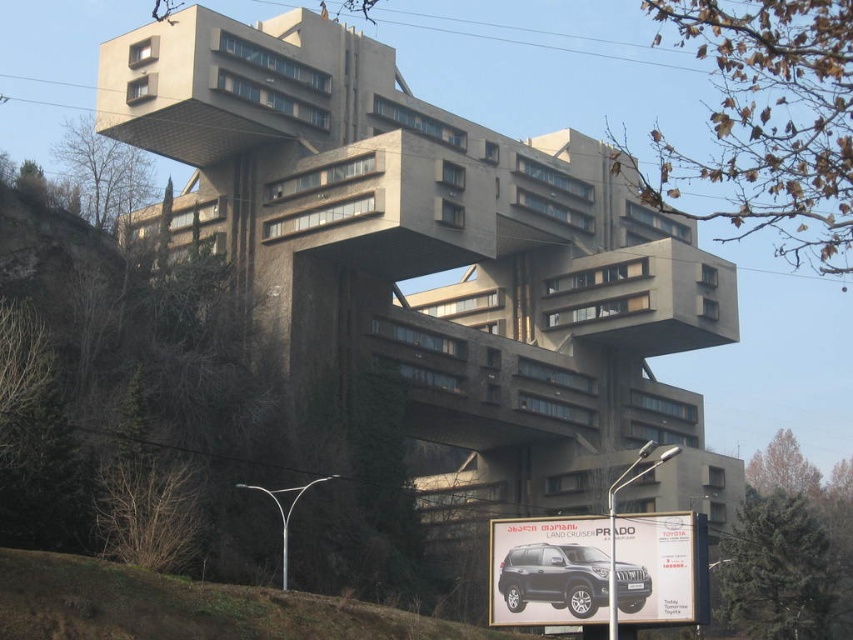
Can you confirm if gray concrete building at center is positioned above matte black suv at center?

Correct, gray concrete building at center is located above matte black suv at center.

Is point (299, 161) farther from camera compared to point (573, 592)?

Yes.

Does point (403, 348) come farther from viewer compared to point (546, 579)?

Yes.

The width and height of the screenshot is (853, 640). In order to click on gray concrete building at center in this screenshot , I will do `click(437, 259)`.

Can you confirm if gray concrete building at center is thinner than brown grass at lower left?

No, gray concrete building at center is not thinner than brown grass at lower left.

Does gray concrete building at center have a greater height compared to brown grass at lower left?

Yes, gray concrete building at center is taller than brown grass at lower left.

Between point (575, 220) and point (270, 589), which one is positioned in front?

Point (270, 589) is in front.

Identify the location of gray concrete building at center. (437, 259).

Which is above, brown grass at lower left or matte black suv at center?

matte black suv at center is higher up.

Is brown grass at lower left smaller than matte black suv at center?

Incorrect, brown grass at lower left is not smaller in size than matte black suv at center.

Which is behind, point (173, 621) or point (553, 598)?

The point (553, 598) is behind.

Find the location of a particular element. This screenshot has height=640, width=853. brown grass at lower left is located at coordinates (186, 608).